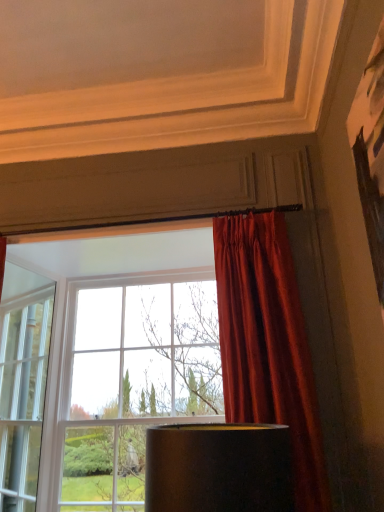
This screenshot has width=384, height=512. In order to click on matte glass window at center in this screenshot , I will do `click(158, 368)`.

Image resolution: width=384 pixels, height=512 pixels. Describe the element at coordinates (158, 368) in the screenshot. I see `matte glass window at center` at that location.

Describe the element at coordinates (268, 344) in the screenshot. I see `satin red curtain at right` at that location.

Locate an element on the screen. Image resolution: width=384 pixels, height=512 pixels. satin red curtain at right is located at coordinates (268, 344).

What are the coordinates of `matte glass window at center` in the screenshot? It's located at (158, 368).

Is satin red curtain at right to the left of matte glass window at center from the viewer's perspective?

Incorrect, satin red curtain at right is not on the left side of matte glass window at center.

Is satin red curtain at right further to camera compared to matte glass window at center?

No, satin red curtain at right is in front of matte glass window at center.

Which is in front, point (249, 302) or point (8, 437)?

The point (249, 302) is more forward.

From the image's perspective, is satin red curtain at right over matte glass window at center?

Yes, from the image's perspective, satin red curtain at right is above matte glass window at center.

From a real-world perspective, is satin red curtain at right physically below matte glass window at center?

No, from a real-world perspective, satin red curtain at right is not under matte glass window at center.

Between satin red curtain at right and matte glass window at center, which one has larger width?

matte glass window at center.

Between satin red curtain at right and matte glass window at center, which one has less height?

satin red curtain at right is shorter.

Is satin red curtain at right bigger or smaller than matte glass window at center?

Clearly, satin red curtain at right is smaller in size than matte glass window at center.

Is matte glass window at center located within satin red curtain at right?

No, matte glass window at center is located outside of satin red curtain at right.

Is the surface of satin red curtain at right in direct contact with matte glass window at center?

No.

Is satin red curtain at right facing away from matte glass window at center?

Yes, satin red curtain at right is facing away from matte glass window at center.

How many degrees apart are the facing directions of satin red curtain at right and matte glass window at center?

The angle between the facing direction of satin red curtain at right and the facing direction of matte glass window at center is 0.693 degrees.

How distant is satin red curtain at right from matte glass window at center?

satin red curtain at right and matte glass window at center are 1.22 meters apart from each other.

The height and width of the screenshot is (512, 384). What are the coordinates of `window on the left of satin red curtain at right` in the screenshot? It's located at (158, 368).

Which object is positioned more to the left, matte glass window at center or satin red curtain at right?

matte glass window at center is more to the left.

Considering the relative positions of matte glass window at center and satin red curtain at right in the image provided, is matte glass window at center in front of satin red curtain at right?

No, the depth of matte glass window at center is greater than that of satin red curtain at right.

Which is closer to the camera, [139,493] or [284,276]?

Point [139,493].

In the scene shown: From the image's perspective, which one is positioned higher, matte glass window at center or satin red curtain at right?

satin red curtain at right.

From a real-world perspective, is matte glass window at center physically located above or below satin red curtain at right?

Clearly, from a real-world perspective, matte glass window at center is below satin red curtain at right.

Does matte glass window at center have a greater width compared to satin red curtain at right?

Indeed, matte glass window at center has a greater width compared to satin red curtain at right.

Can you confirm if matte glass window at center is shorter than satin red curtain at right?

Incorrect, the height of matte glass window at center does not fall short of that of satin red curtain at right.

Between matte glass window at center and satin red curtain at right, which one has larger size?

Bigger between the two is matte glass window at center.

Is satin red curtain at right surrounded by matte glass window at center?

Actually, satin red curtain at right is outside matte glass window at center.

Is there a large distance between matte glass window at center and satin red curtain at right?

matte glass window at center is far away from satin red curtain at right.

Based on the photo, could you tell me if matte glass window at center is turned towards satin red curtain at right?

Yes, matte glass window at center is turned towards satin red curtain at right.

What's the angular difference between matte glass window at center and satin red curtain at right's facing directions?

The angle between the facing direction of matte glass window at center and the facing direction of satin red curtain at right is 0.693 degrees.

At what (x,y) coordinates should I click in order to perform the action: click on curtain above the matte glass window at center (from a real-world perspective). Please return your answer as a coordinate pair (x, y). This screenshot has height=512, width=384. Looking at the image, I should click on (268, 344).

Identify the location of curtain that appears in front of the matte glass window at center. (268, 344).

I want to click on curtain that is on the right side of matte glass window at center, so click(x=268, y=344).